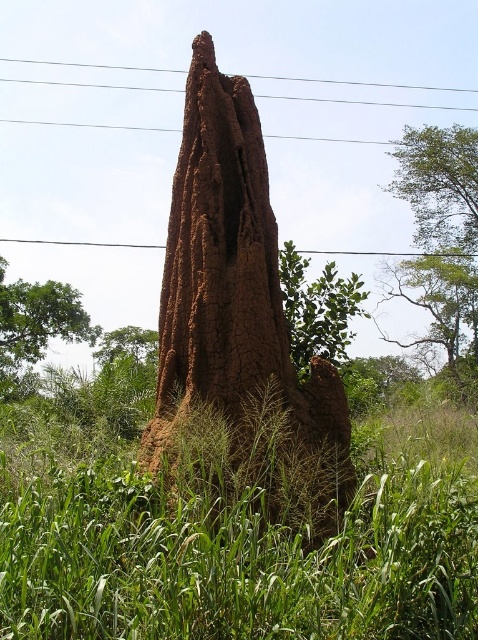
The width and height of the screenshot is (478, 640). What do you see at coordinates (440, 186) in the screenshot? I see `green leafy tree at upper right` at bounding box center [440, 186].

Is green leafy tree at upper right above green leafy tree at left?

Indeed, green leafy tree at upper right is positioned over green leafy tree at left.

Does point (443, 234) lie behind point (24, 392)?

Yes, point (443, 234) is farther from viewer.

Locate an element on the screen. green leafy tree at upper right is located at coordinates (440, 186).

Between point (206, 404) and point (21, 378), which one is positioned in front?

Point (206, 404) is in front.

Looking at this image, measure the distance between point (213, 380) and camera.

A distance of 5.07 meters exists between point (213, 380) and camera.

Image resolution: width=478 pixels, height=640 pixels. I want to click on brown clay termite mound at center, so click(239, 317).

Is point (32, 358) more distant than point (285, 257)?

Yes.

Between green leafy tree at left and green leafy tree at center, which one has more height?

With more height is green leafy tree at left.

Where is `green leafy tree at left`? This screenshot has height=640, width=478. green leafy tree at left is located at coordinates (35, 326).